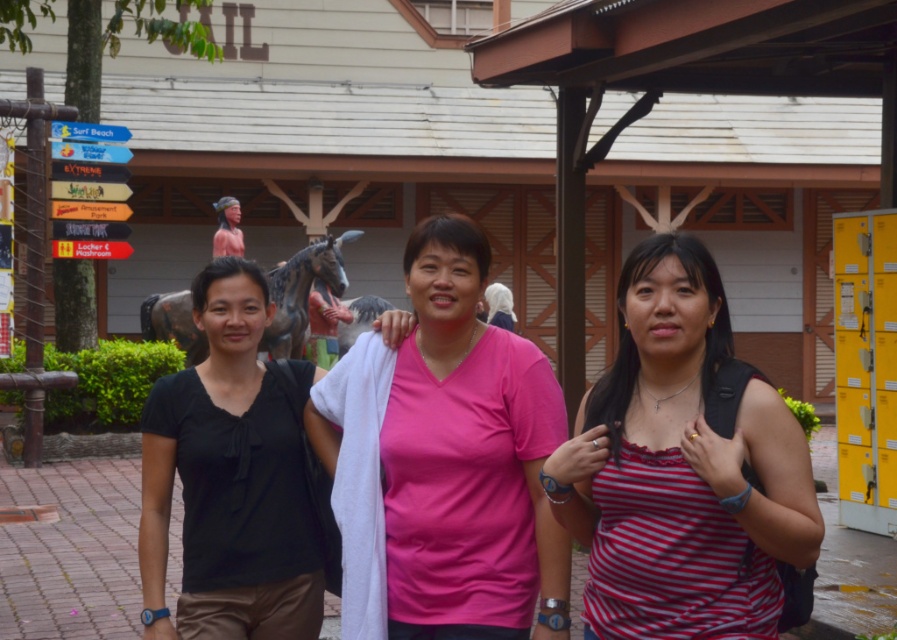
From the picture: Between striped cotton tank top at center and black matte shirt at left, which one is positioned higher?

striped cotton tank top at center is higher up.

Does striped cotton tank top at center have a lesser width compared to black matte shirt at left?

In fact, striped cotton tank top at center might be wider than black matte shirt at left.

Which is behind, point (581, 477) or point (251, 385)?

Point (251, 385)

Locate an element on the screen. striped cotton tank top at center is located at coordinates (681, 468).

Can you confirm if pink matte shirt at center is shorter than black matte shirt at left?

Incorrect, pink matte shirt at center's height does not fall short of black matte shirt at left's.

What do you see at coordinates (466, 460) in the screenshot? Image resolution: width=897 pixels, height=640 pixels. I see `pink matte shirt at center` at bounding box center [466, 460].

The height and width of the screenshot is (640, 897). What do you see at coordinates (466, 460) in the screenshot?
I see `pink matte shirt at center` at bounding box center [466, 460].

This screenshot has width=897, height=640. I want to click on pink matte shirt at center, so click(466, 460).

Is point (647, 518) closer to camera compared to point (448, 332)?

Yes, it is.

Does striped cotton tank top at center have a smaller size compared to pink matte shirt at center?

No, striped cotton tank top at center is not smaller than pink matte shirt at center.

Which is behind, point (816, 529) or point (524, 630)?

The point (524, 630) is more distant.

Locate an element on the screen. striped cotton tank top at center is located at coordinates (681, 468).